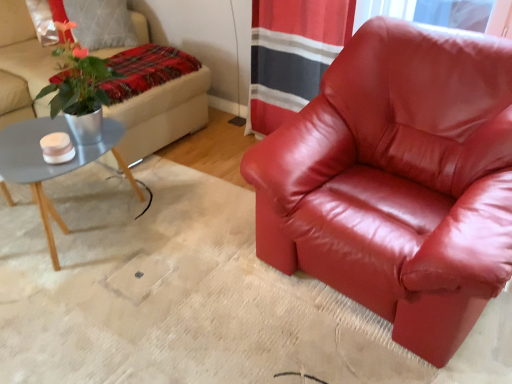
Identify the location of vacant area that is in front of matte gray coffee table at left. (78, 322).